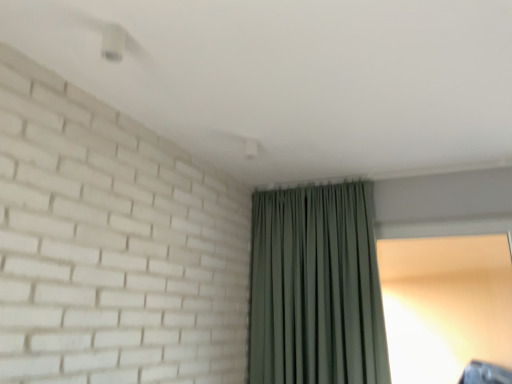
Question: Are transparent glass window at right and green fabric curtain at center located far from each other?

Choices:
 (A) no
 (B) yes

Answer: (A)

Question: Can you confirm if transparent glass window at right is thinner than green fabric curtain at center?

Choices:
 (A) yes
 (B) no

Answer: (A)

Question: Does transparent glass window at right come in front of green fabric curtain at center?

Choices:
 (A) yes
 (B) no

Answer: (B)

Question: Can you confirm if transparent glass window at right is taller than green fabric curtain at center?

Choices:
 (A) yes
 (B) no

Answer: (B)

Question: Does transparent glass window at right have a greater width compared to green fabric curtain at center?

Choices:
 (A) yes
 (B) no

Answer: (B)

Question: Is transparent glass window at right at the right side of green fabric curtain at center?

Choices:
 (A) no
 (B) yes

Answer: (B)

Question: Is green fabric curtain at center beside transparent glass window at right?

Choices:
 (A) no
 (B) yes

Answer: (A)

Question: Is transparent glass window at right inside green fabric curtain at center?

Choices:
 (A) no
 (B) yes

Answer: (A)

Question: Considering the relative sizes of green fabric curtain at center and transparent glass window at right in the image provided, is green fabric curtain at center wider than transparent glass window at right?

Choices:
 (A) yes
 (B) no

Answer: (A)

Question: From the image's perspective, would you say green fabric curtain at center is positioned over transparent glass window at right?

Choices:
 (A) no
 (B) yes

Answer: (B)

Question: Considering the relative sizes of green fabric curtain at center and transparent glass window at right in the image provided, is green fabric curtain at center shorter than transparent glass window at right?

Choices:
 (A) no
 (B) yes

Answer: (A)

Question: Is green fabric curtain at center positioned with its back to transparent glass window at right?

Choices:
 (A) yes
 (B) no

Answer: (B)

Question: In terms of height, does green fabric curtain at center look taller or shorter compared to transparent glass window at right?

Choices:
 (A) short
 (B) tall

Answer: (B)